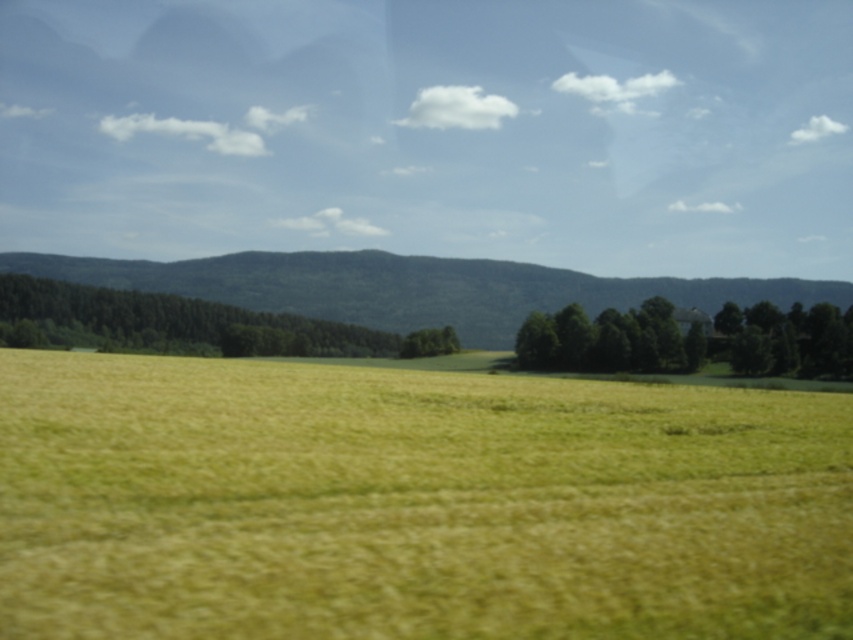
Question: Which point is closer to the camera?

Choices:
 (A) (91, 339)
 (B) (444, 556)
 (C) (766, 314)

Answer: (B)

Question: Estimate the real-world distances between objects in this image. Which object is closer to the green leafy trees at center?

Choices:
 (A) yellow grassy field at center
 (B) green leafy trees at left
 (C) green leafy tree at center

Answer: (C)

Question: Is yellow grassy field at center closer to the viewer compared to green leafy tree at center?

Choices:
 (A) yes
 (B) no

Answer: (A)

Question: Is green leafy trees at center above green leafy tree at center?

Choices:
 (A) yes
 (B) no

Answer: (B)

Question: Does yellow grassy field at center appear under green leafy trees at left?

Choices:
 (A) yes
 (B) no

Answer: (B)

Question: Which point appears closest to the camera in this image?

Choices:
 (A) (450, 346)
 (B) (608, 324)
 (C) (33, 316)

Answer: (B)